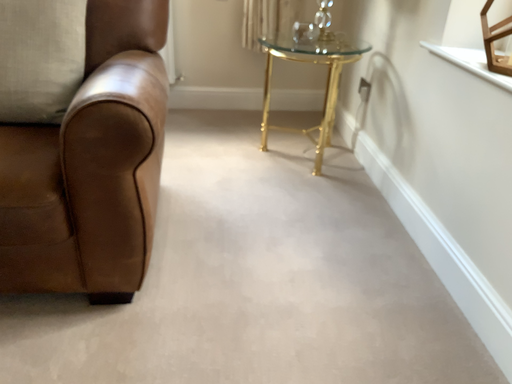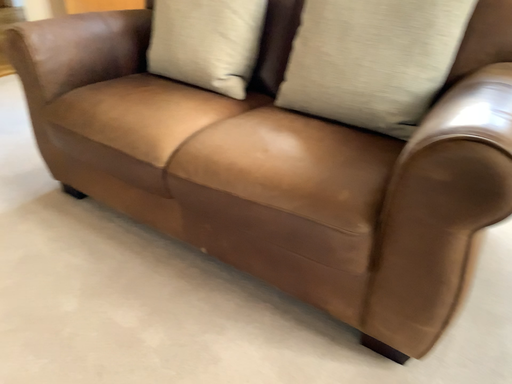
Question: How did the camera likely rotate when shooting the video?

Choices:
 (A) rotated right
 (B) rotated left

Answer: (B)